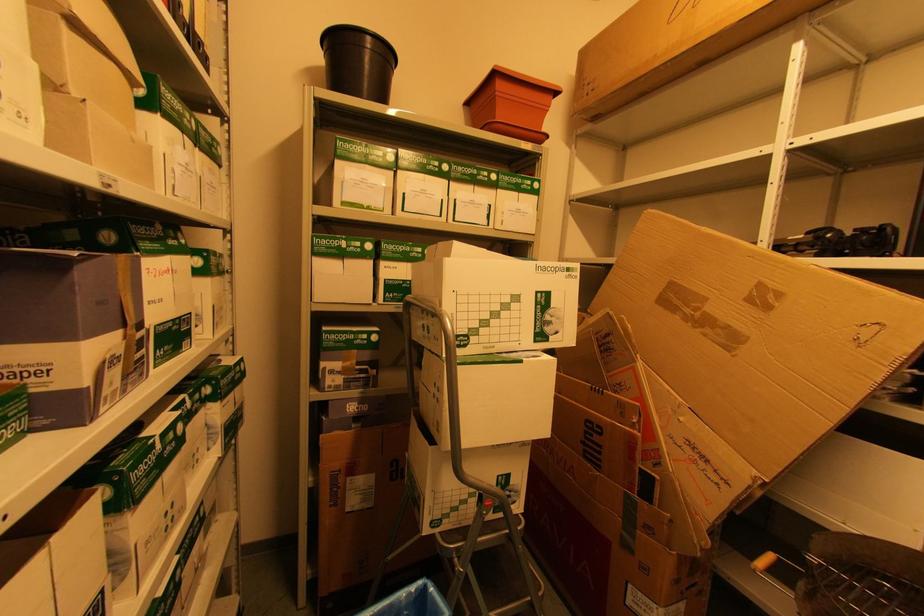
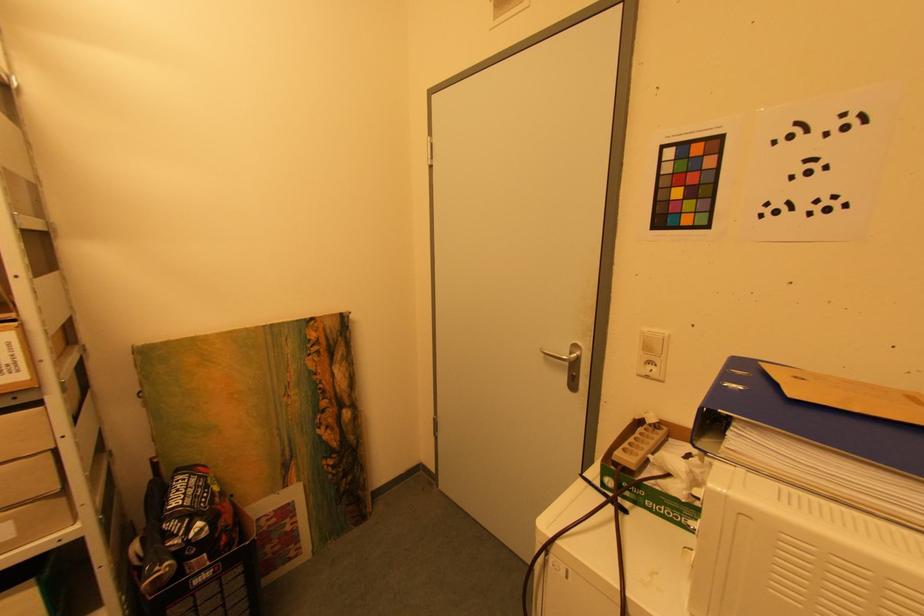
The images are taken continuously from a first-person perspective. In which direction is your viewpoint rotating?

The rotation direction of the camera is right-down.